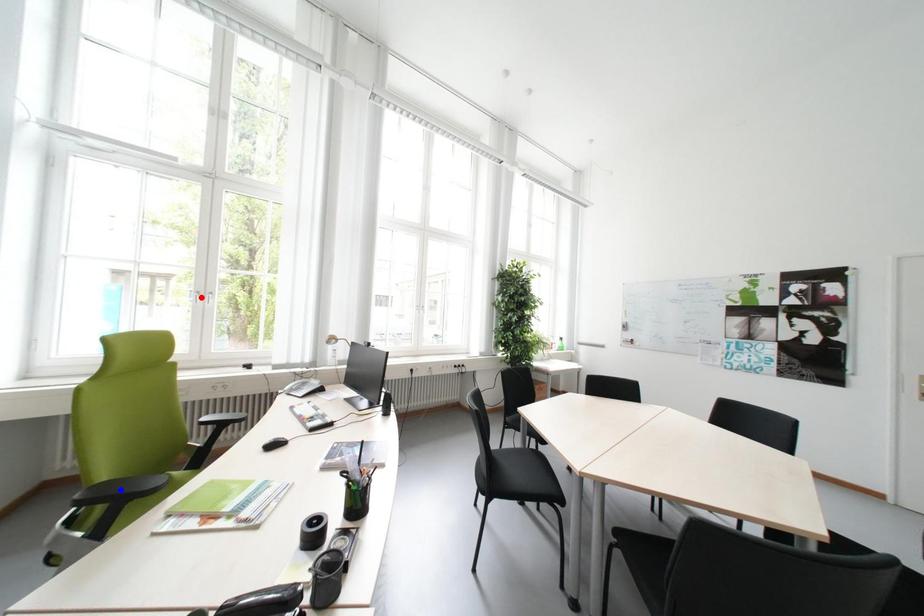
Question: Two points are marked on the image. Which point is closer to the camera?

Choices:
 (A) Blue point is closer.
 (B) Red point is closer.

Answer: (A)